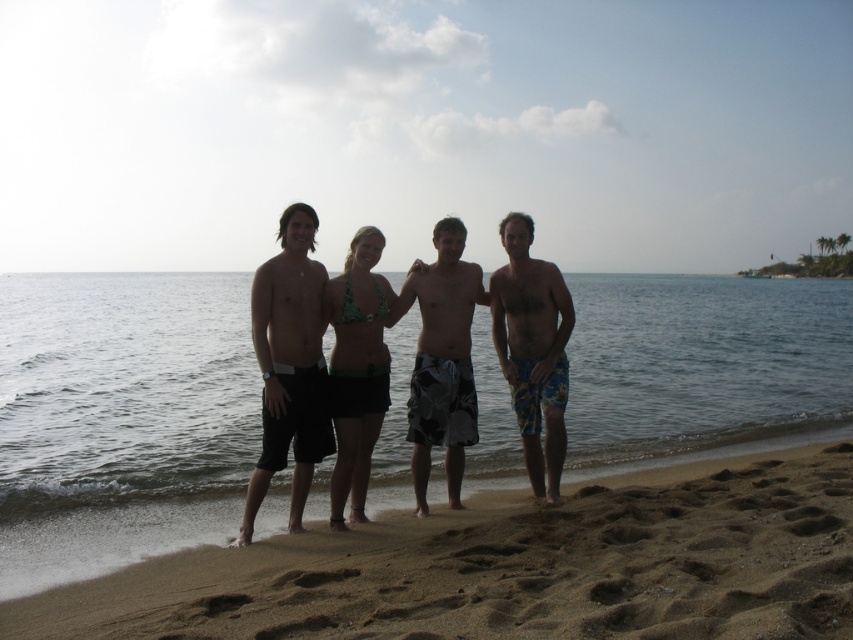
Does clear blue water at center have a lesser width compared to floral swim trunks at right?

In fact, clear blue water at center might be wider than floral swim trunks at right.

Between clear blue water at center and floral swim trunks at right, which one appears on the right side from the viewer's perspective?

clear blue water at center is more to the right.

This screenshot has width=853, height=640. Describe the element at coordinates (125, 390) in the screenshot. I see `clear blue water at center` at that location.

Identify the location of clear blue water at center. tap(125, 390).

Does brown sandy beach at lower center come behind camouflage-patterned shorts at center?

No, it is in front of camouflage-patterned shorts at center.

Find the location of a particular element. The width and height of the screenshot is (853, 640). brown sandy beach at lower center is located at coordinates (515, 566).

Identify the location of brown sandy beach at lower center. This screenshot has height=640, width=853. (515, 566).

Is black matte shorts at center above floral swim trunks at right?

Incorrect, black matte shorts at center is not positioned above floral swim trunks at right.

Who is more forward, (282, 296) or (531, 360)?

Point (282, 296) is in front.

I want to click on black matte shorts at center, so click(x=289, y=365).

Locate an element on the screen. The width and height of the screenshot is (853, 640). black matte shorts at center is located at coordinates (289, 365).